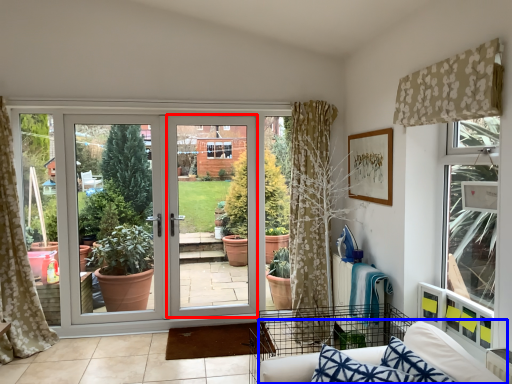
Question: Among these objects, which one is farthest to the camera, screen door (highlighted by a red box) or couch (highlighted by a blue box)?

Choices:
 (A) screen door
 (B) couch

Answer: (A)